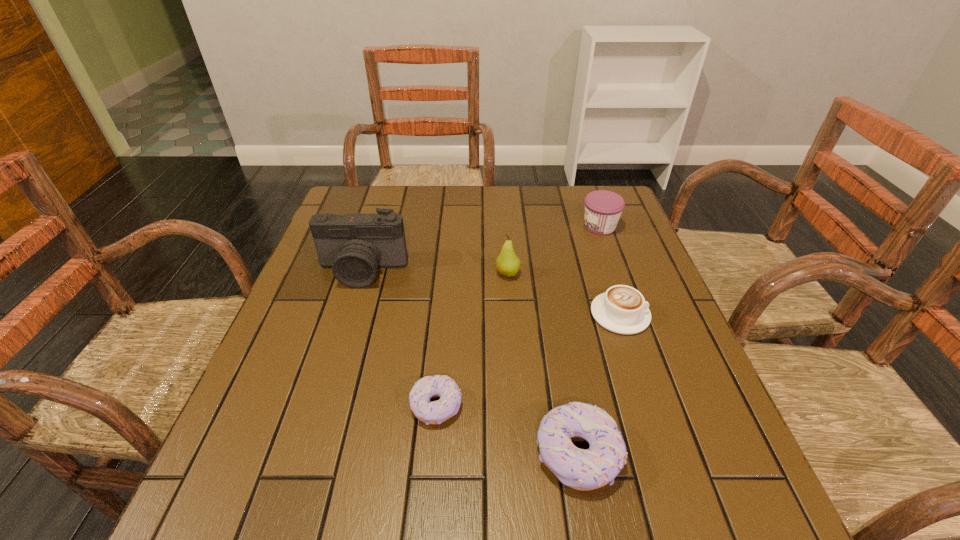
The image size is (960, 540). What are the coordinates of `the shortest object` in the screenshot? It's located at (436, 412).

Find the location of `the left doughnut`. the left doughnut is located at coordinates (436, 412).

Locate an element on the screen. This screenshot has width=960, height=540. the right doughnut is located at coordinates (580, 469).

This screenshot has height=540, width=960. Identify the location of jam. (603, 208).

The height and width of the screenshot is (540, 960). I want to click on the fourth shortest object, so click(603, 208).

Locate an element on the screen. the tallest object is located at coordinates (354, 245).

Image resolution: width=960 pixels, height=540 pixels. Identify the location of the leftmost object. (354, 245).

Where is `pear`? The height and width of the screenshot is (540, 960). pear is located at coordinates (507, 263).

I want to click on cappuccino, so click(x=622, y=309).

Image resolution: width=960 pixels, height=540 pixels. Identify the location of the second shortest object. (622, 309).